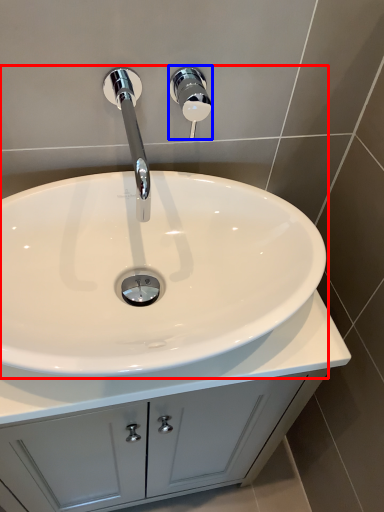
Question: Which of the following is the closest to the observer, sink (highlighted by a red box) or shower (highlighted by a blue box)?

Choices:
 (A) sink
 (B) shower

Answer: (A)